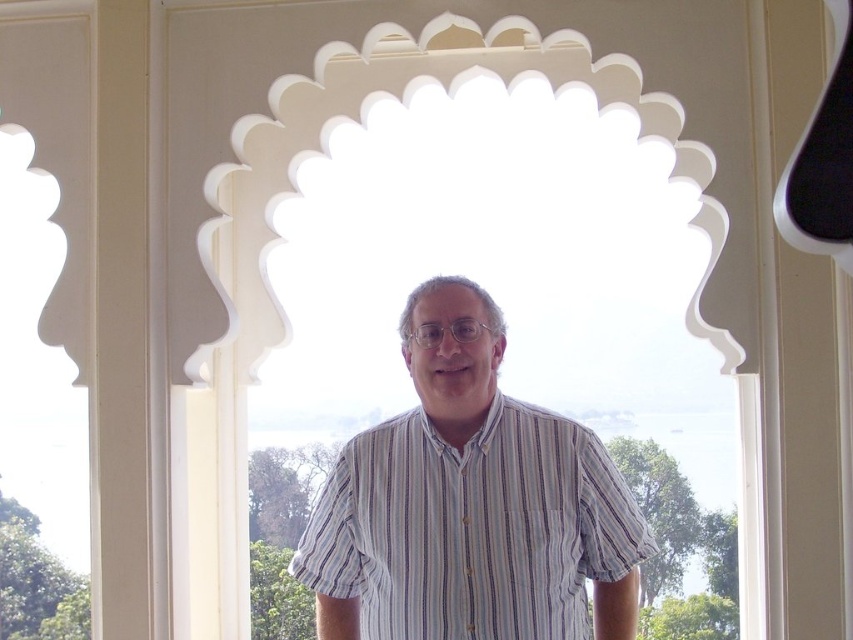
Question: Which point is farther to the camera?

Choices:
 (A) (262, 24)
 (B) (549, 468)

Answer: (A)

Question: Among these points, which one is nearest to the camera?

Choices:
 (A) (482, 406)
 (B) (413, 20)

Answer: (A)

Question: Is white matte window at center above striped cotton shirt at center?

Choices:
 (A) yes
 (B) no

Answer: (A)

Question: Which of the following is the closest to the observer?

Choices:
 (A) striped cotton shirt at center
 (B) white matte window at center

Answer: (A)

Question: Is white matte window at center closer to camera compared to striped cotton shirt at center?

Choices:
 (A) yes
 (B) no

Answer: (B)

Question: Is white matte window at center thinner than striped cotton shirt at center?

Choices:
 (A) yes
 (B) no

Answer: (B)